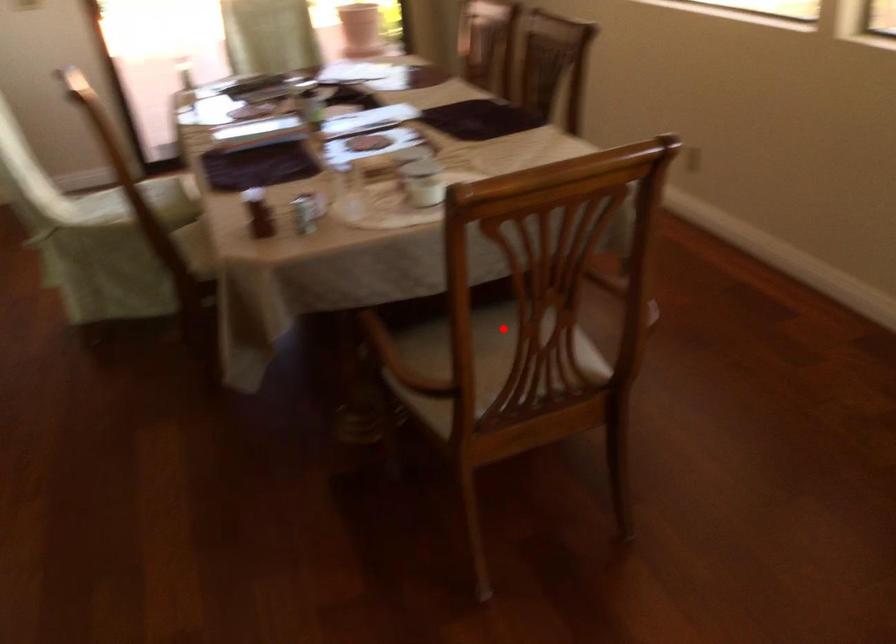
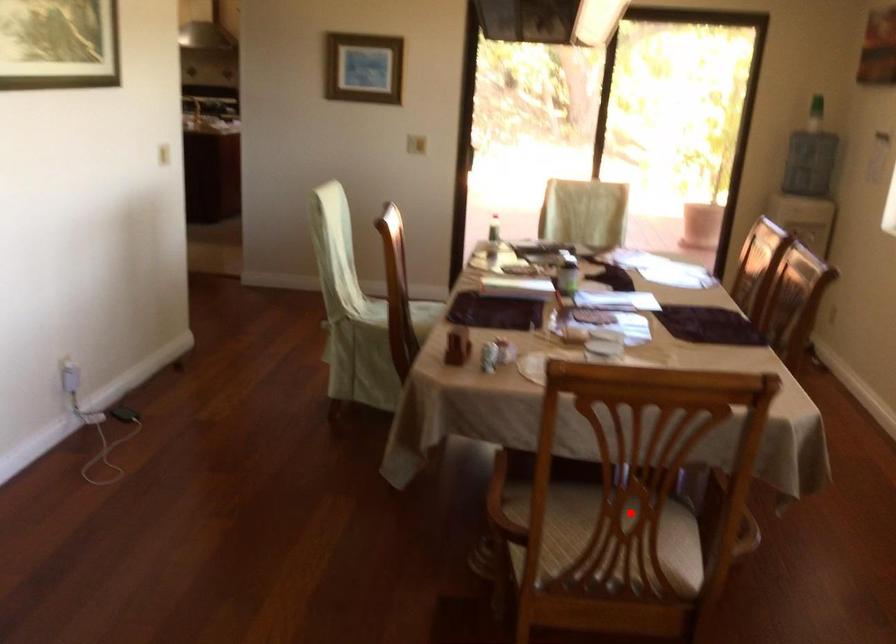
I am providing you with two images of the same scene from different viewpoints. A red point is marked on the first image and another point is marked on the second image. Is the red point in image1 aligned with the point shown in image2?

Yes